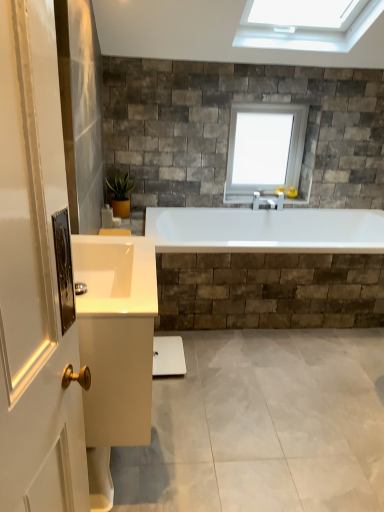
Question: Relative to white glass window at upper center, is white glossy cabinet at lower left in front or behind?

Choices:
 (A) behind
 (B) front

Answer: (B)

Question: In the image, is white glossy cabinet at lower left on the left side or the right side of white glass window at upper center?

Choices:
 (A) left
 (B) right

Answer: (A)

Question: Estimate the real-world distances between objects in this image. Which object is closer to the white glossy sink at lower left?

Choices:
 (A) white glossy cabinet at lower left
 (B) white glass window at upper center
 (C) green matte plant at upper left

Answer: (A)

Question: Estimate the real-world distances between objects in this image. Which object is farther from the white glossy cabinet at lower left?

Choices:
 (A) white glass window at upper center
 (B) white glossy sink at lower left
 (C) green matte plant at upper left

Answer: (A)